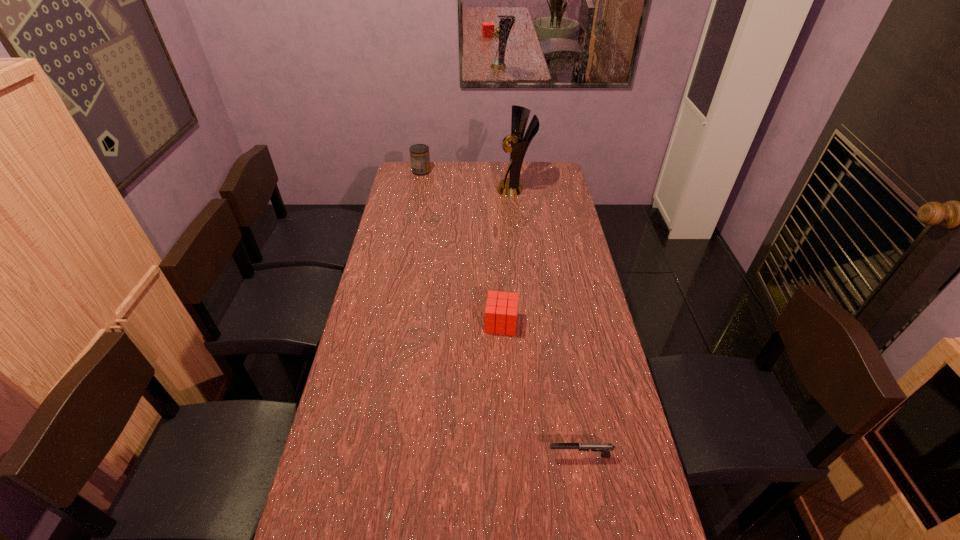
Identify the location of the second farthest object. (510, 187).

You are a GUI agent. You are given a task and a screenshot of the screen. Output one action in this format:
    pyautogui.click(x=<x>, y=<y>)
    Task: Click on the tallest object
    The image size is (960, 540).
    Given the screenshot: What is the action you would take?
    pos(510,187)

You are a GUI agent. You are given a task and a screenshot of the screen. Output one action in this format:
    pyautogui.click(x=<x>, y=<y>)
    Task: Click on the farthest object
    Image resolution: width=960 pixels, height=540 pixels.
    Given the screenshot: What is the action you would take?
    pyautogui.click(x=419, y=153)

At what (x,y) coordinates should I click in order to perform the action: click on the leftmost object. Please return your answer as a coordinate pair (x, y). Looking at the image, I should click on pos(419,153).

Locate an element on the screen. Image resolution: width=960 pixels, height=540 pixels. the third tallest object is located at coordinates (501, 311).

Identify the location of the third farthest object. This screenshot has width=960, height=540. pyautogui.click(x=501, y=311).

Where is `gun`? The width and height of the screenshot is (960, 540). gun is located at coordinates (605, 448).

At what (x,y) coordinates should I click in order to perform the action: click on the nearest object. Please return your answer as a coordinate pair (x, y). The image size is (960, 540). Looking at the image, I should click on (605, 448).

Image resolution: width=960 pixels, height=540 pixels. In order to click on free location located at the front of the second farthest object, where the globe is visible in this screenshot , I will do `click(419, 189)`.

This screenshot has width=960, height=540. Find the location of `blank space located 0.350m at the front of the second farthest object, where the globe is visible`. blank space located 0.350m at the front of the second farthest object, where the globe is visible is located at coordinates (425, 189).